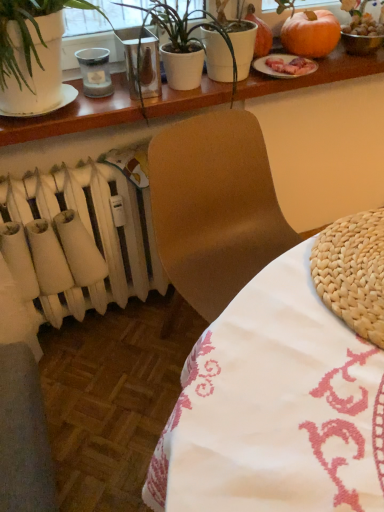
This screenshot has width=384, height=512. Identify the location of vacant area that lies to the right of metallic glass vase at upper center. (192, 94).